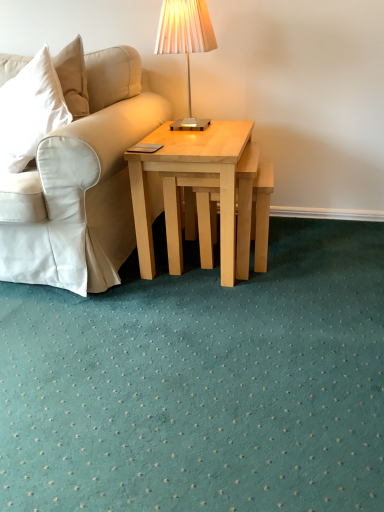
Question: From a real-world perspective, is metallic silver table lamp at upper center above or below light wood stool at center?

Choices:
 (A) above
 (B) below

Answer: (A)

Question: Is metallic silver table lamp at upper center inside the boundaries of light wood stool at center, or outside?

Choices:
 (A) outside
 (B) inside

Answer: (A)

Question: Estimate the real-world distances between objects in this image. Which object is closer to the metallic silver table lamp at upper center?

Choices:
 (A) natural wood coffee table at center
 (B) light wood stool at center

Answer: (A)

Question: Which object is positioned closest to the light wood stool at center?

Choices:
 (A) metallic silver table lamp at upper center
 (B) natural wood coffee table at center

Answer: (B)